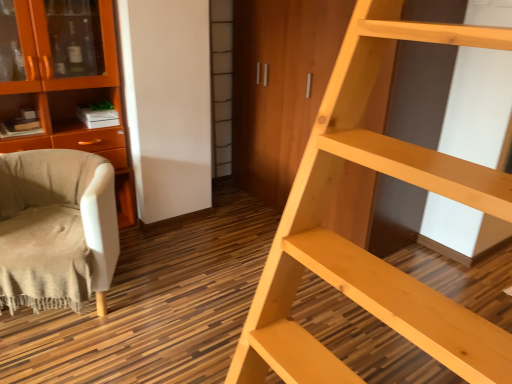
Question: Is orange wood cabinet at left positioned in front of beige fabric chair at left?

Choices:
 (A) no
 (B) yes

Answer: (A)

Question: Does orange wood cabinet at left have a larger size compared to beige fabric chair at left?

Choices:
 (A) yes
 (B) no

Answer: (A)

Question: Is the position of orange wood cabinet at left more distant than that of beige fabric chair at left?

Choices:
 (A) no
 (B) yes

Answer: (B)

Question: Can you confirm if orange wood cabinet at left is smaller than beige fabric chair at left?

Choices:
 (A) yes
 (B) no

Answer: (B)

Question: Can you confirm if orange wood cabinet at left is taller than beige fabric chair at left?

Choices:
 (A) yes
 (B) no

Answer: (A)

Question: Considering the relative sizes of orange wood cabinet at left and beige fabric chair at left in the image provided, is orange wood cabinet at left thinner than beige fabric chair at left?

Choices:
 (A) yes
 (B) no

Answer: (A)

Question: Is orange wood cabinet at left oriented towards light wood ladder at right?

Choices:
 (A) no
 (B) yes

Answer: (B)

Question: Can you confirm if orange wood cabinet at left is wider than light wood ladder at right?

Choices:
 (A) yes
 (B) no

Answer: (B)

Question: From a real-world perspective, is orange wood cabinet at left located higher than light wood ladder at right?

Choices:
 (A) no
 (B) yes

Answer: (A)

Question: Can you confirm if orange wood cabinet at left is taller than light wood ladder at right?

Choices:
 (A) yes
 (B) no

Answer: (B)

Question: Does orange wood cabinet at left have a smaller size compared to light wood ladder at right?

Choices:
 (A) yes
 (B) no

Answer: (A)

Question: Is the position of orange wood cabinet at left more distant than that of light wood ladder at right?

Choices:
 (A) no
 (B) yes

Answer: (B)

Question: Considering the relative positions of light wood ladder at right and orange wood cabinet at left in the image provided, is light wood ladder at right to the right of orange wood cabinet at left from the viewer's perspective?

Choices:
 (A) no
 (B) yes

Answer: (B)